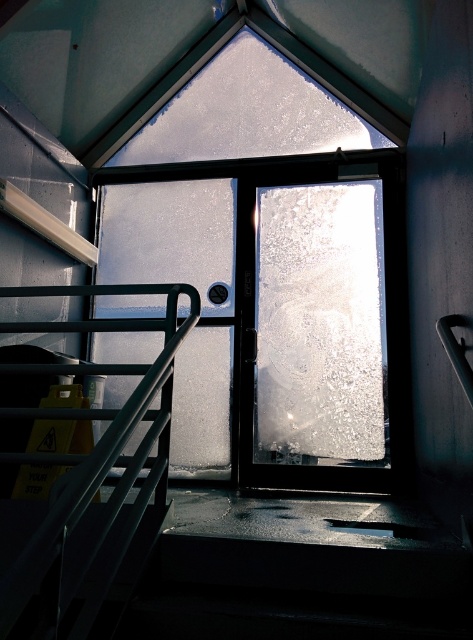
Question: Among these points, which one is farthest from the camera?

Choices:
 (A) (112, 170)
 (B) (379, 227)
 (C) (192, 323)

Answer: (A)

Question: Can you confirm if frosted glass window at center is bigger than metallic black handrail at upper left?

Choices:
 (A) no
 (B) yes

Answer: (A)

Question: Which object is the closest to the metallic black handrail at upper left?

Choices:
 (A) frosted glass door at center
 (B) frosted glass window at center

Answer: (A)

Question: Which object appears farthest from the camera in this image?

Choices:
 (A) frosted glass window at center
 (B) metallic black handrail at upper left
 (C) frosted glass door at center

Answer: (A)

Question: Can you confirm if frosted glass door at center is wider than frosted glass window at center?

Choices:
 (A) yes
 (B) no

Answer: (A)

Question: Can you confirm if frosted glass door at center is positioned below frosted glass window at center?

Choices:
 (A) yes
 (B) no

Answer: (B)